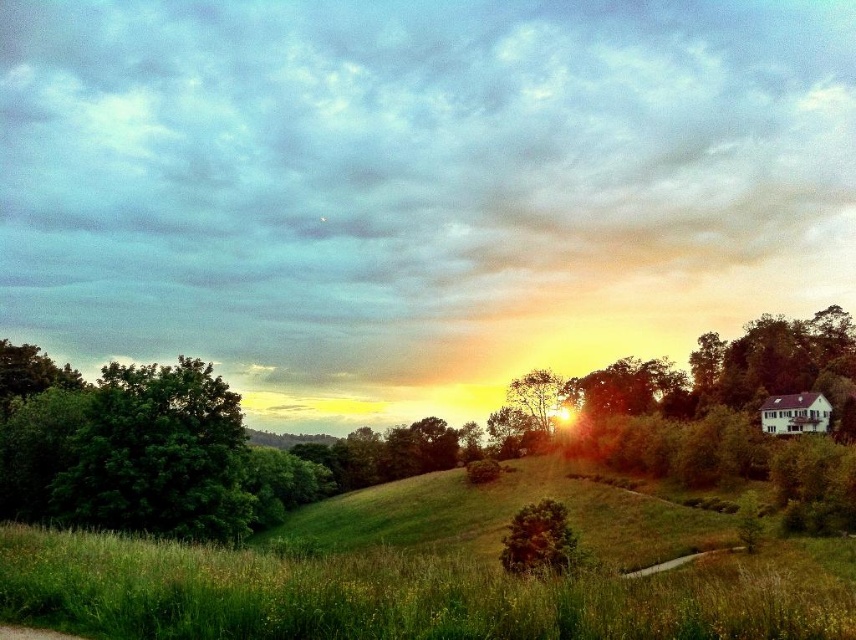
Can you confirm if green grassy hill at center is smaller than green leafy tree at center?

Correct, green grassy hill at center occupies less space than green leafy tree at center.

At what (x,y) coordinates should I click in order to perform the action: click on green grassy hill at center. Please return your answer as a coordinate pair (x, y). The height and width of the screenshot is (640, 856). Looking at the image, I should click on (432, 573).

Does green leafy tree at center have a lesser height compared to green leafy tree at left?

No, green leafy tree at center is not shorter than green leafy tree at left.

Describe the element at coordinates (453, 436) in the screenshot. The width and height of the screenshot is (856, 640). I see `green leafy tree at center` at that location.

You are a GUI agent. You are given a task and a screenshot of the screen. Output one action in this format:
    pyautogui.click(x=<x>, y=<y>)
    Task: Click on the green leafy tree at center
    The image size is (856, 640).
    Given the screenshot: What is the action you would take?
    pyautogui.click(x=453, y=436)

Between green grassy hill at center and green leafy tree at left, which one has less height?

With less height is green leafy tree at left.

Find the location of a particular element. green grassy hill at center is located at coordinates (432, 573).